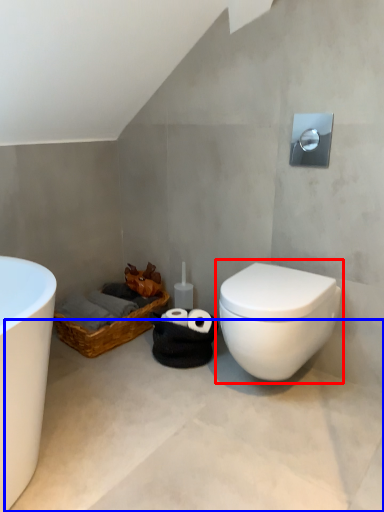
Question: Which object appears farthest to the camera in this image, toilet (highlighted by a red box) or concrete (highlighted by a blue box)?

Choices:
 (A) toilet
 (B) concrete

Answer: (A)